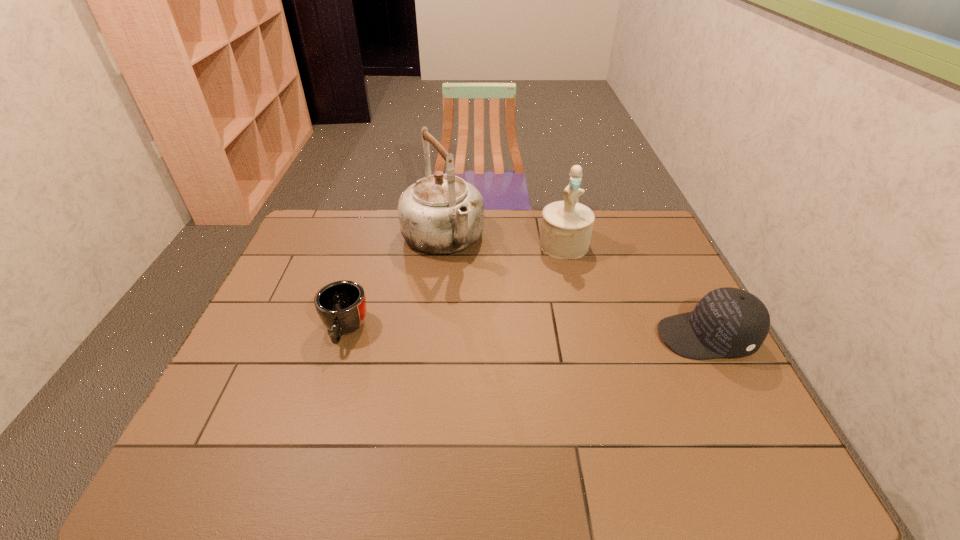
Where is `the leftmost object`? Image resolution: width=960 pixels, height=540 pixels. the leftmost object is located at coordinates (341, 305).

This screenshot has height=540, width=960. I want to click on mug, so click(x=341, y=305).

At what (x,y) coordinates should I click in order to perform the action: click on the third tallest object. Please return your answer as a coordinate pair (x, y). The image size is (960, 540). Looking at the image, I should click on (727, 322).

Image resolution: width=960 pixels, height=540 pixels. I want to click on baseball cap, so click(x=727, y=322).

Locate an element on the screen. The width and height of the screenshot is (960, 540). the second object from right to left is located at coordinates (566, 228).

Identify the location of figurine. The height and width of the screenshot is (540, 960). (566, 228).

This screenshot has width=960, height=540. Find the location of `the third object from right to left`. the third object from right to left is located at coordinates (440, 214).

Locate an element on the screen. The width and height of the screenshot is (960, 540). the tallest object is located at coordinates (440, 214).

This screenshot has height=540, width=960. In order to click on free space located 0.160m on the side of the mug with the handle in this screenshot , I will do `click(321, 408)`.

Identify the location of vacant area situated 0.310m at the front of the baseball cap where the brim is located. The width and height of the screenshot is (960, 540). (544, 337).